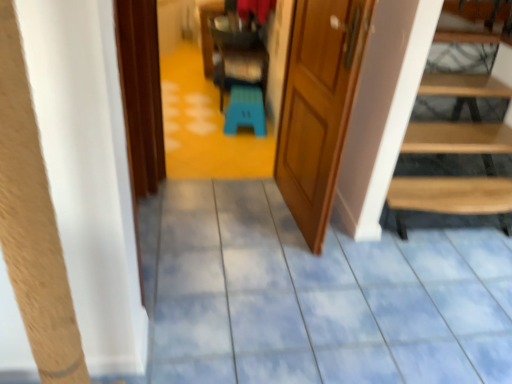
The image size is (512, 384). Find the location of `blue glossy tile floor at center`. blue glossy tile floor at center is located at coordinates (316, 296).

This screenshot has height=384, width=512. What do you see at coordinates (245, 110) in the screenshot?
I see `blue plastic stool at center` at bounding box center [245, 110].

Locate an element on the screen. Image resolution: width=512 pixels, height=384 pixels. blue plastic stool at center is located at coordinates (245, 110).

Find the location of a particular element. The width and height of the screenshot is (512, 384). wooden door at center is located at coordinates point(318,106).

Is wooden door at center taller or shorter than blue plastic stool at center?

Considering their sizes, wooden door at center has more height than blue plastic stool at center.

Is wooden door at center at the left side of blue plastic stool at center?

In fact, wooden door at center is to the right of blue plastic stool at center.

From the image's perspective, would you say wooden door at center is shown under blue plastic stool at center?

Yes, from the image's perspective, wooden door at center is beneath blue plastic stool at center.

Is blue plastic stool at center thinner than blue glossy tile floor at center?

Yes.

Are blue plastic stool at center and blue glossy tile floor at center making contact?

No, blue plastic stool at center is not with blue glossy tile floor at center.

From the image's perspective, which is below, blue plastic stool at center or blue glossy tile floor at center?

blue glossy tile floor at center is shown below in the image.

From the image's perspective, relative to wooden door at center, is blue plastic stool at center above or below?

blue plastic stool at center is situated higher than wooden door at center in the image.

Does blue plastic stool at center have a lesser width compared to wooden door at center?

No, blue plastic stool at center is not thinner than wooden door at center.

Considering the sizes of blue plastic stool at center and wooden door at center in the image, is blue plastic stool at center bigger or smaller than wooden door at center?

blue plastic stool at center is smaller than wooden door at center.

From a real-world perspective, who is located higher, blue plastic stool at center or wooden door at center?

wooden door at center is physically above.

Based on their positions, is blue glossy tile floor at center located to the left or right of wooden door at center?

Clearly, blue glossy tile floor at center is on the right of wooden door at center in the image.

From a real-world perspective, is blue glossy tile floor at center positioned above or below wooden door at center?

From a real-world perspective, blue glossy tile floor at center is physically below wooden door at center.

From the image's perspective, which one is positioned lower, blue glossy tile floor at center or wooden door at center?

blue glossy tile floor at center.

Based on the photo, considering the sizes of objects blue glossy tile floor at center and wooden door at center in the image provided, who is smaller, blue glossy tile floor at center or wooden door at center?

wooden door at center is smaller.

Relative to blue plastic stool at center, is blue glossy tile floor at center in front or behind?

In the image, blue glossy tile floor at center appears in front of blue plastic stool at center.

Consider the image. From a real-world perspective, which is physically below, blue glossy tile floor at center or blue plastic stool at center?

blue glossy tile floor at center.

Is blue glossy tile floor at center oriented away from blue plastic stool at center?

blue glossy tile floor at center does not have its back to blue plastic stool at center.

From a real-world perspective, is wooden door at center physically above blue glossy tile floor at center?

Indeed, from a real-world perspective, wooden door at center stands above blue glossy tile floor at center.

Is the position of wooden door at center more distant than that of blue glossy tile floor at center?

Yes, wooden door at center is further from the viewer.

Which is closer to the camera, (309, 223) or (372, 283)?

Point (309, 223) is farther from the camera than point (372, 283).

Can you confirm if wooden door at center is bigger than blue glossy tile floor at center?

No.

This screenshot has width=512, height=384. In order to click on stool lying on the left of wooden door at center in this screenshot , I will do `click(245, 110)`.

The height and width of the screenshot is (384, 512). In order to click on stool behind the blue glossy tile floor at center in this screenshot , I will do `click(245, 110)`.

Which object lies further to the anchor point wooden door at center, blue glossy tile floor at center or blue plastic stool at center?

Based on the image, blue plastic stool at center appears to be further to wooden door at center.

When comparing their distances from blue glossy tile floor at center, does wooden door at center or blue plastic stool at center seem closer?

wooden door at center is closer to blue glossy tile floor at center.

In the scene shown: Estimate the real-world distances between objects in this image. Which object is further from blue glossy tile floor at center, blue plastic stool at center or wooden door at center?

Based on the image, blue plastic stool at center appears to be further to blue glossy tile floor at center.

Based on their spatial positions, is wooden door at center or blue glossy tile floor at center further from blue plastic stool at center?

blue glossy tile floor at center.

Looking at the image, which one is located further to wooden door at center, blue plastic stool at center or blue glossy tile floor at center?

Among the two, blue plastic stool at center is located further to wooden door at center.

Which object lies further to the anchor point blue plastic stool at center, blue glossy tile floor at center or wooden door at center?

Based on the image, blue glossy tile floor at center appears to be further to blue plastic stool at center.

You are a GUI agent. You are given a task and a screenshot of the screen. Output one action in this format:
    pyautogui.click(x=<x>, y=<y>)
    Task: Click on the door between blue glossy tile floor at center and blue plastic stool at center along the z-axis
    The image size is (512, 384).
    Given the screenshot: What is the action you would take?
    pyautogui.click(x=318, y=106)